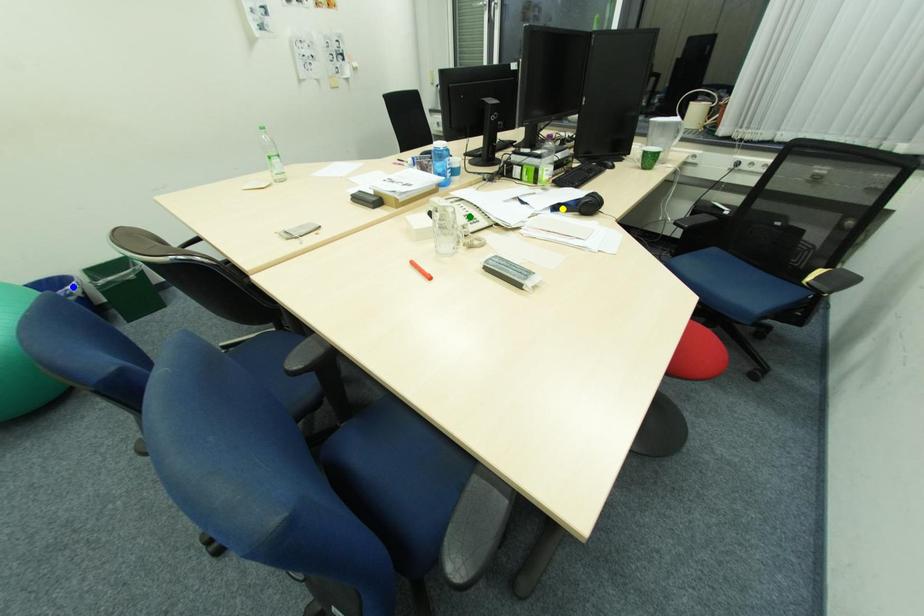
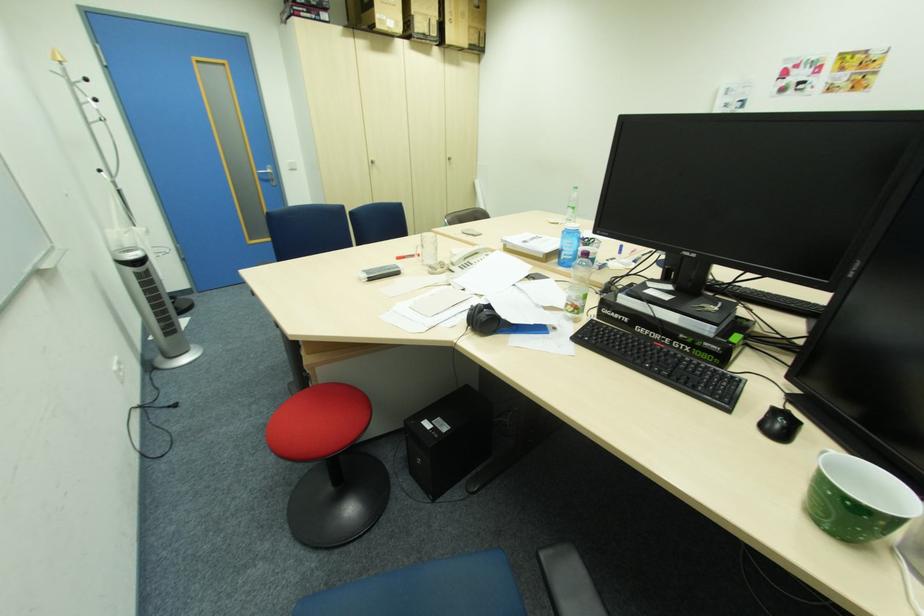
I am providing you with two images of the same scene from different viewpoints. Three points are marked in image1. Which point corresponds to a part or object that is occluded in image2?In image1, three points are marked. Which of them correspond to a part or object that is occluded in image2?Among the three points shown in image1, which one corresponds to a part or object that is no longer visible due to occlusion in image2?

yellow point, blue point cannot be seen in image2.